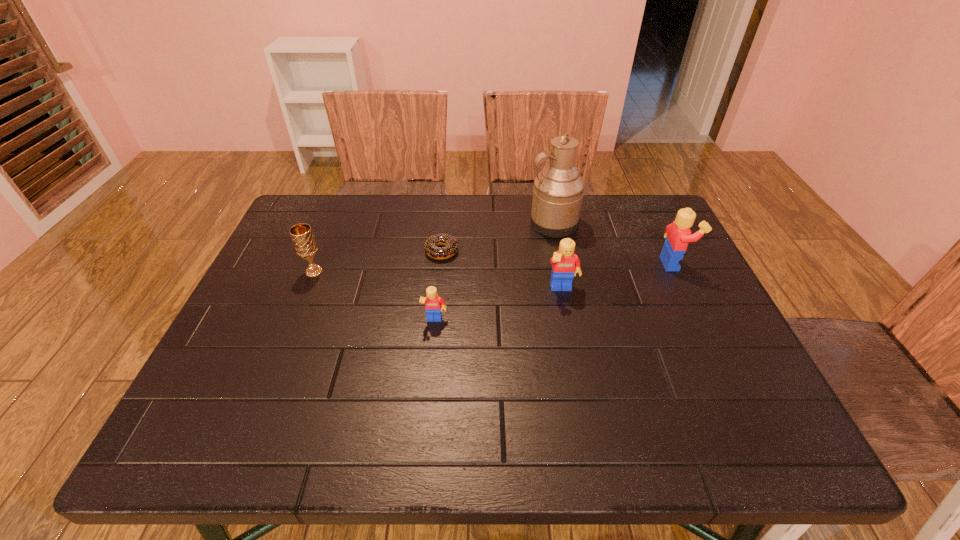
Where is `the nearest Lego`? The height and width of the screenshot is (540, 960). the nearest Lego is located at coordinates (434, 304).

Locate an element on the screen. The image size is (960, 540). the leftmost Lego is located at coordinates (434, 304).

I want to click on the fifth farthest object, so click(565, 264).

The image size is (960, 540). I want to click on the second farthest Lego, so click(x=565, y=264).

Find the location of a particular element. This screenshot has width=960, height=540. the rightmost object is located at coordinates (678, 234).

Identify the location of the rightmost Lego. (678, 234).

Where is `the tallest object`? The width and height of the screenshot is (960, 540). the tallest object is located at coordinates (558, 190).

Locate an element on the screen. the farthest object is located at coordinates (558, 190).

Find the location of a particular element. the shortest object is located at coordinates (451, 246).

The height and width of the screenshot is (540, 960). Find the location of `the leftmost object`. the leftmost object is located at coordinates (304, 243).